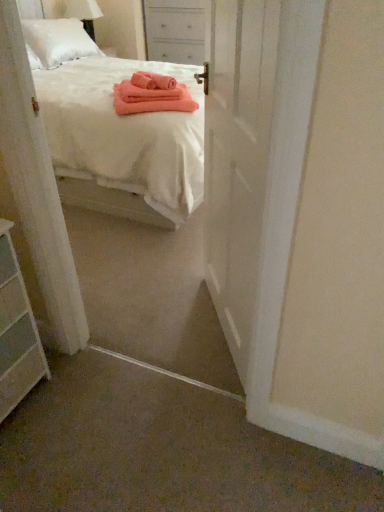
Question: Is white cotton bed at center aimed at white painted wood nightstand at upper center?

Choices:
 (A) yes
 (B) no

Answer: (B)

Question: Is white cotton bed at center at the left side of white painted wood nightstand at upper center?

Choices:
 (A) yes
 (B) no

Answer: (A)

Question: Is white cotton bed at center looking in the opposite direction of white painted wood nightstand at upper center?

Choices:
 (A) no
 (B) yes

Answer: (A)

Question: Considering the relative sizes of white cotton bed at center and white painted wood nightstand at upper center in the image provided, is white cotton bed at center bigger than white painted wood nightstand at upper center?

Choices:
 (A) no
 (B) yes

Answer: (B)

Question: Does white cotton bed at center come behind white painted wood nightstand at upper center?

Choices:
 (A) yes
 (B) no

Answer: (B)

Question: From the image's perspective, is white painted wood nightstand at upper center above or below white glossy door at center?

Choices:
 (A) above
 (B) below

Answer: (A)

Question: From a real-world perspective, relative to white glossy door at center, is white painted wood nightstand at upper center vertically above or below?

Choices:
 (A) below
 (B) above

Answer: (B)

Question: Is point (168, 35) positioned closer to the camera than point (228, 170)?

Choices:
 (A) closer
 (B) farther

Answer: (B)

Question: Is white painted wood nightstand at upper center in front of or behind white glossy door at center in the image?

Choices:
 (A) front
 (B) behind

Answer: (B)

Question: Is white painted wood nightstand at upper center in front of or behind white cotton bed at center in the image?

Choices:
 (A) front
 (B) behind

Answer: (B)

Question: Is point 168,5 closer or farther from the camera than point 155,211?

Choices:
 (A) farther
 (B) closer

Answer: (A)

Question: Looking at the image, does white painted wood nightstand at upper center seem bigger or smaller compared to white cotton bed at center?

Choices:
 (A) big
 (B) small

Answer: (B)

Question: From a real-world perspective, is white painted wood nightstand at upper center above or below white cotton bed at center?

Choices:
 (A) below
 (B) above

Answer: (B)

Question: In terms of height, does white cotton bed at center look taller or shorter compared to white glossy door at center?

Choices:
 (A) short
 (B) tall

Answer: (A)

Question: Would you say white cotton bed at center is inside or outside white glossy door at center?

Choices:
 (A) inside
 (B) outside

Answer: (B)